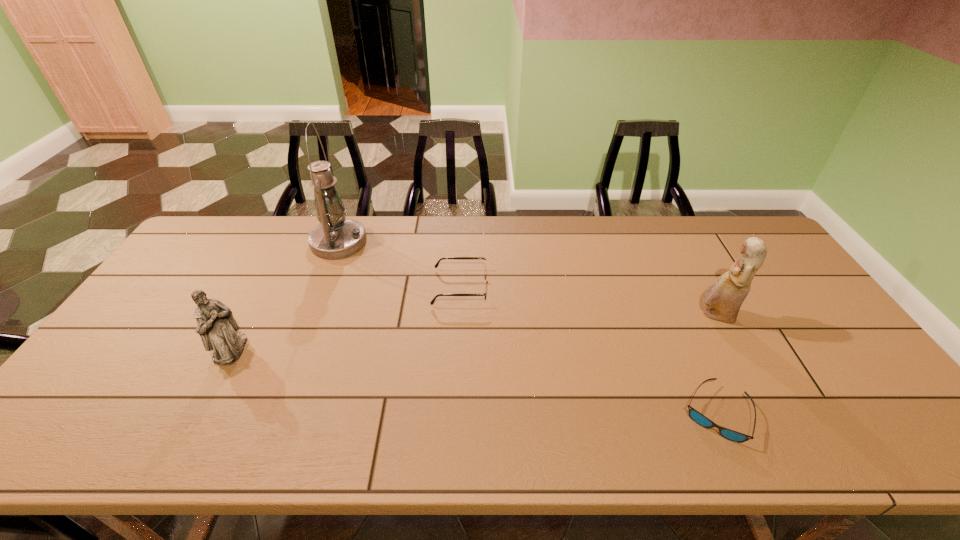
At what (x,y) coordinates should I click in order to perform the action: click on the farthest object. Please return your answer as a coordinate pair (x, y). Looking at the image, I should click on (336, 237).

The image size is (960, 540). What are the coordinates of `oil lamp` in the screenshot? It's located at (336, 237).

Locate an element on the screen. This screenshot has height=540, width=960. the right figurine is located at coordinates (723, 298).

Image resolution: width=960 pixels, height=540 pixels. I want to click on the taller figurine, so click(x=723, y=298).

Locate an element on the screen. the fourth farthest object is located at coordinates (218, 330).

The width and height of the screenshot is (960, 540). Find the location of `the leftmost object`. the leftmost object is located at coordinates (218, 330).

Image resolution: width=960 pixels, height=540 pixels. In order to click on the third object from left to right in this screenshot , I will do `click(486, 275)`.

I want to click on spectacles, so click(x=486, y=275).

In order to click on the shortest object in this screenshot , I will do `click(697, 417)`.

Where is `the nearest object`? This screenshot has width=960, height=540. the nearest object is located at coordinates (697, 417).